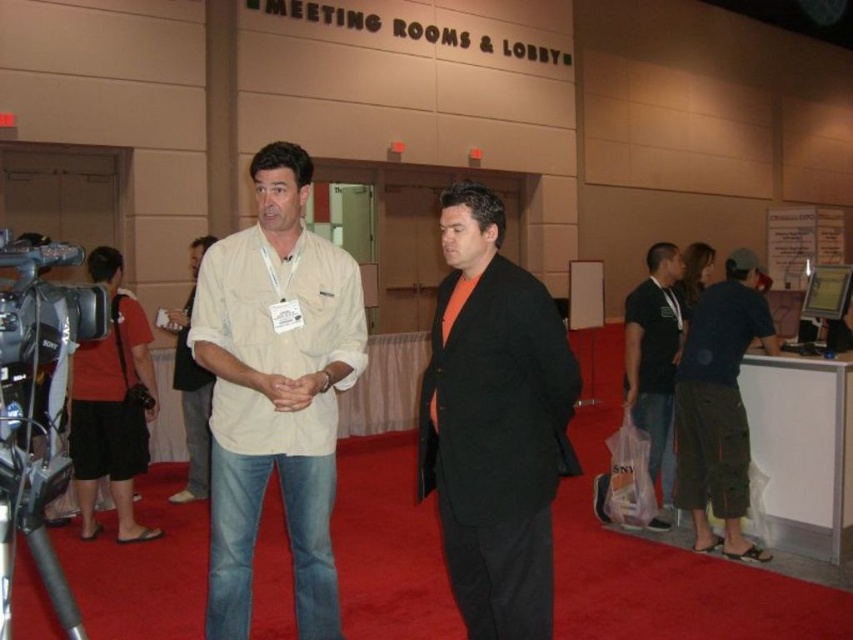
You are a photographer at the convention center and need to determine if the beige cotton shirt at center will block the view of the silver metallic video camera at left when taking a photo from the front. Can you confirm?

The beige cotton shirt at center is larger in size than the silver metallic video camera at left, so it may block the view of the camera depending on their exact positions. However, since the shirt is at the center and the camera is at the left, they might not be directly overlapping. Further details about their arrangement are needed to determine if blocking occurs.

You are a photographer at the convention center and need to place a silver metallic video camera at left and dark green cargo pants at right in a display case. The display case can only accommodate items narrower than 30 cm. Which item is suitable for the display case?

The silver metallic video camera at left has a width less than the dark green cargo pants at right, so it is suitable for the display case if its width is under 30 cm. However, since the exact width isn not provided, we can only confirm the camera is narrower than the pants.

You are a photographer who needs to capture a clear shot of the beige cotton shirt at center and the silver metallic video camera at left. Considering their heights, which object will appear larger in your photo?

The beige cotton shirt at center will appear larger in the photo because it is much taller than the silver metallic video camera at left.